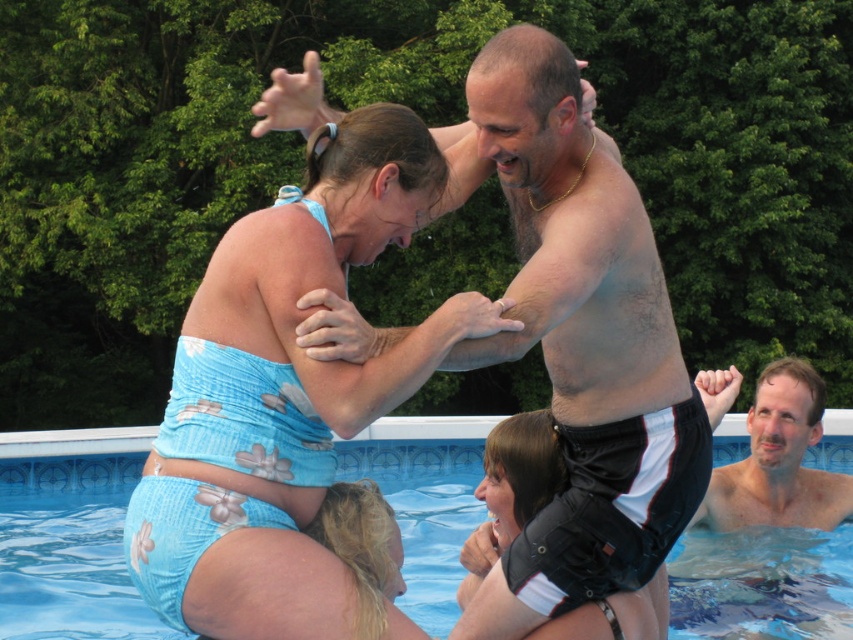
Question: Among these points, which one is farthest from the camera?

Choices:
 (A) (767, 440)
 (B) (86, 604)

Answer: (B)

Question: Does blue floral swimsuit at upper center have a smaller size compared to smooth skin man at upper right?

Choices:
 (A) yes
 (B) no

Answer: (A)

Question: Among these objects, which one is nearest to the camera?

Choices:
 (A) shiny metallic arm at upper center
 (B) blue fabric swimming pool at center

Answer: (A)

Question: Does blue fabric swimming pool at center come in front of smooth skin man at upper right?

Choices:
 (A) yes
 (B) no

Answer: (B)

Question: Can you confirm if shiny metallic arm at upper center is positioned below smooth skin man at upper right?

Choices:
 (A) yes
 (B) no

Answer: (B)

Question: Among these points, which one is farthest from the camera?

Choices:
 (A) (39, 502)
 (B) (578, 468)

Answer: (A)